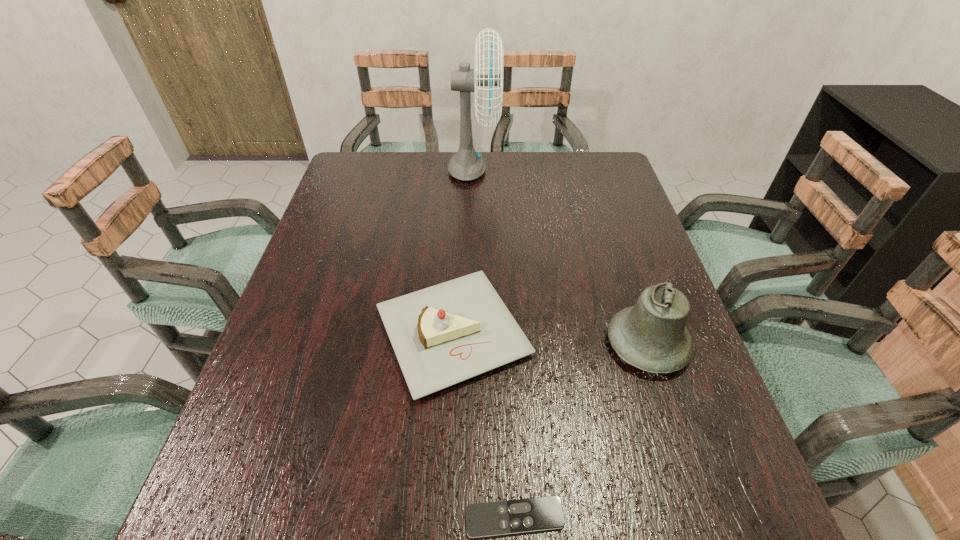
At what (x,y) coordinates should I click in order to perform the action: click on free spot that satisfies the following two spatial constraints: 1. on the back side of the rightmost object; 2. on the front-facing side of the fan. Please return your answer as a coordinate pair (x, y). This screenshot has height=540, width=960. Looking at the image, I should click on (590, 171).

In order to click on vacant position in the image that satisfies the following two spatial constraints: 1. on the back side of the remote control; 2. on the front-facing side of the farthest object in this screenshot , I will do `click(497, 171)`.

Locate an element on the screen. vacant space that satisfies the following two spatial constraints: 1. on the front-facing side of the farthest object; 2. on the right side of the second tallest object is located at coordinates (470, 344).

Where is `vacant point that satisfies the following two spatial constraints: 1. on the front-facing side of the third shortest object; 2. on the right side of the farthest object`? The height and width of the screenshot is (540, 960). vacant point that satisfies the following two spatial constraints: 1. on the front-facing side of the third shortest object; 2. on the right side of the farthest object is located at coordinates (470, 344).

This screenshot has width=960, height=540. In order to click on vacant space that satisfies the following two spatial constraints: 1. on the front-facing side of the fan; 2. on the left side of the remote control in this screenshot , I will do `click(467, 517)`.

This screenshot has width=960, height=540. Find the location of `vacant space that satisfies the following two spatial constraints: 1. on the front-facing side of the farthest object; 2. on the right side of the nearest object`. vacant space that satisfies the following two spatial constraints: 1. on the front-facing side of the farthest object; 2. on the right side of the nearest object is located at coordinates (467, 517).

Find the location of a particular element. Image resolution: width=960 pixels, height=540 pixels. vacant space that satisfies the following two spatial constraints: 1. on the back side of the bell; 2. on the front-facing side of the fan is located at coordinates (590, 171).